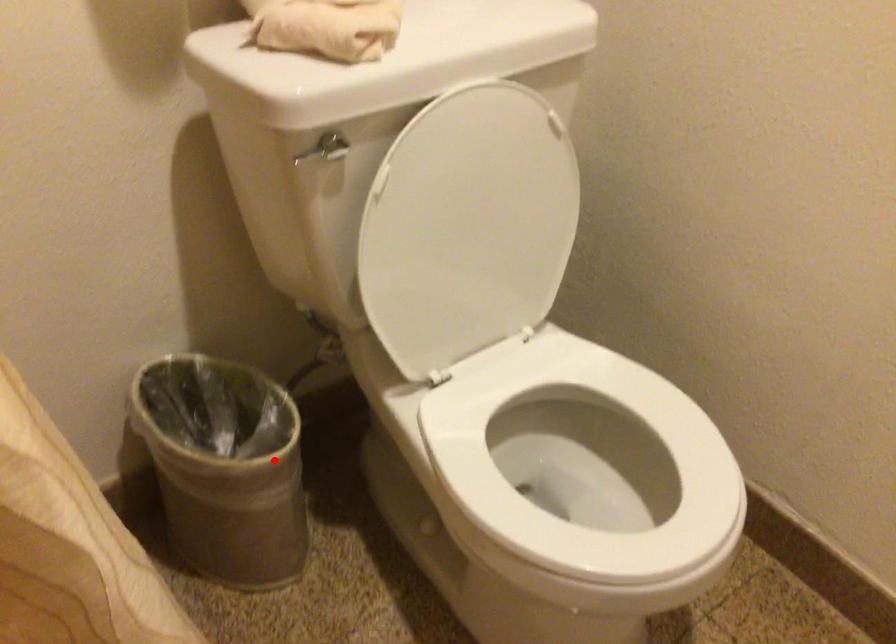
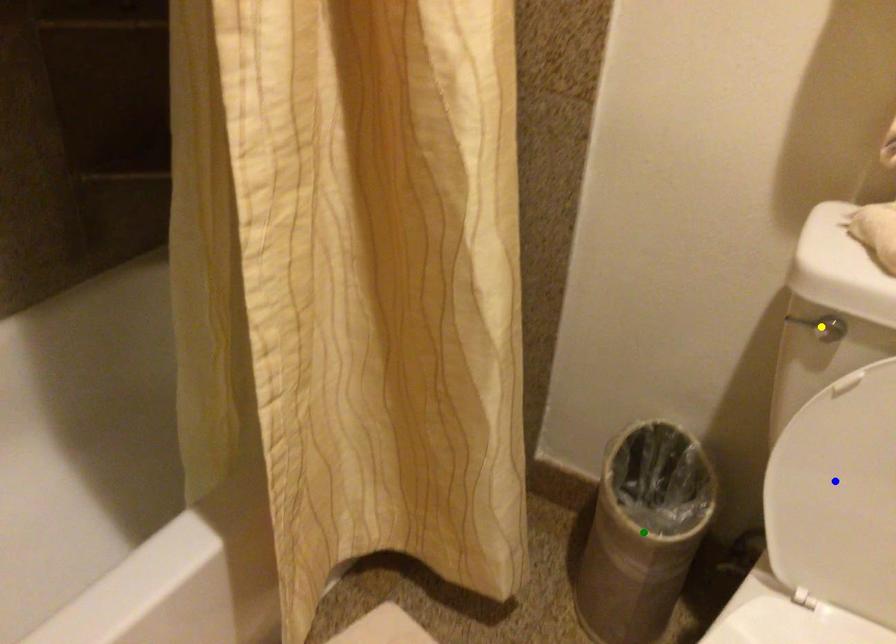
Question: I am providing you with two images of the same scene from different viewpoints. A red point is marked on the first image. You are given multiple points on the second image. Can you choose the point in image 2 that corresponds to the point in image 1?

Choices:
 (A) yellow point
 (B) green point
 (C) blue point

Answer: (B)